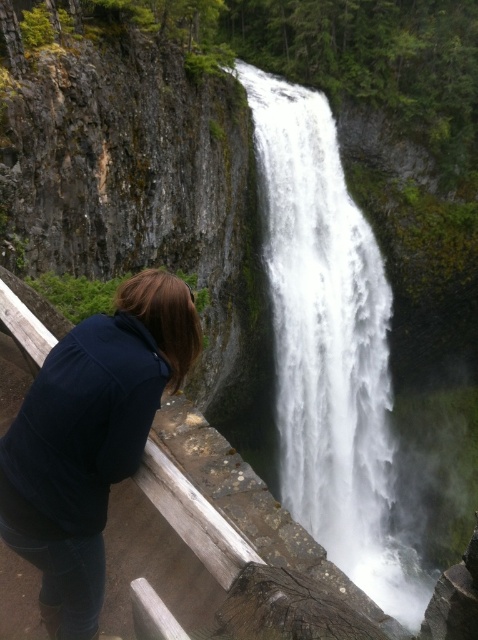
Does white frothy water at center have a greater height compared to dark blue hoodie at lower left?

Correct, white frothy water at center is much taller as dark blue hoodie at lower left.

Is point (352, 307) behind point (10, 492)?

That is True.

The image size is (478, 640). What do you see at coordinates (329, 348) in the screenshot? I see `white frothy water at center` at bounding box center [329, 348].

Locate an element on the screen. white frothy water at center is located at coordinates (329, 348).